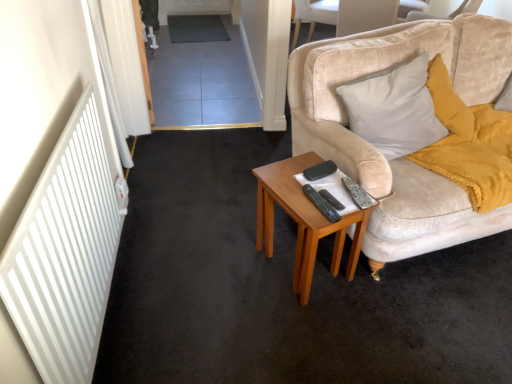
Locate an element on the screen. This screenshot has width=512, height=384. vacant space positioned to the left of black plastic remote control at center, marked as the 3th remote control in a right-to-left arrangement is located at coordinates (292, 198).